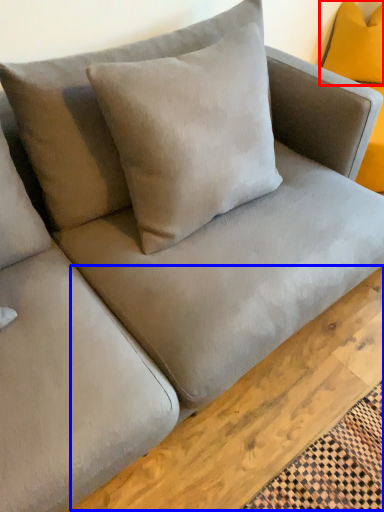
Question: Among these objects, which one is farthest to the camera, pillow (highlighted by a red box) or plank (highlighted by a blue box)?

Choices:
 (A) pillow
 (B) plank

Answer: (A)